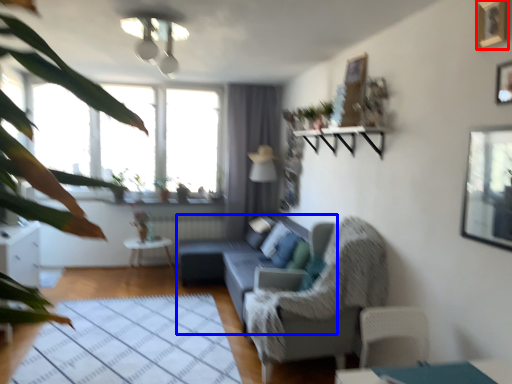
Question: Among these objects, which one is nearest to the camera, picture frame (highlighted by a red box) or studio couch (highlighted by a blue box)?

Choices:
 (A) picture frame
 (B) studio couch

Answer: (A)